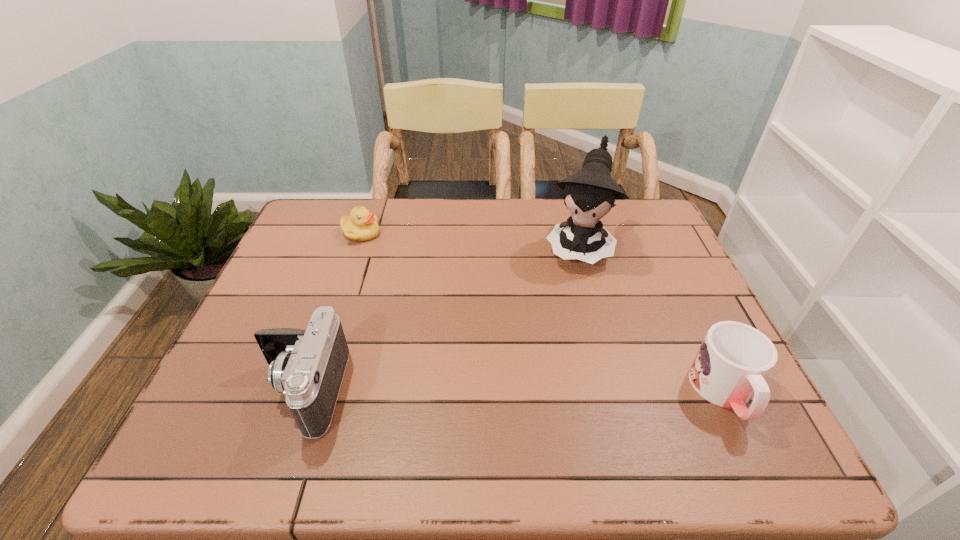
Find the location of a particular element. object at the far left corner is located at coordinates point(361,225).

This screenshot has height=540, width=960. I want to click on object that is at the near left corner, so click(307, 366).

Where is `object positioned at the near right corner`? The image size is (960, 540). object positioned at the near right corner is located at coordinates (733, 360).

Where is `vacant space at the far edge of the desktop`? vacant space at the far edge of the desktop is located at coordinates (541, 225).

You are a GUI agent. You are given a task and a screenshot of the screen. Output one action in this format:
    pyautogui.click(x=<x>, y=<y>)
    Task: Click on the vacant point at the near edge
    
    Given the screenshot: What is the action you would take?
    pyautogui.click(x=614, y=390)

Find the location of a particular element. Image resolution: width=960 pixels, height=540 pixels. vacant space at the left edge of the desktop is located at coordinates (290, 300).

Locate an element on the screen. Image resolution: width=960 pixels, height=540 pixels. vacant space at the right edge is located at coordinates (649, 316).

In the image, there is a desktop. At what (x,y) coordinates should I click in order to perform the action: click on free region at the near left corner. Please return your answer as a coordinate pair (x, y). Looking at the image, I should click on (269, 392).

At what (x,y) coordinates should I click in order to perform the action: click on blank space at the far right corner of the desktop. Please return your answer as a coordinate pair (x, y). The width and height of the screenshot is (960, 540). Looking at the image, I should click on pos(627,224).

The height and width of the screenshot is (540, 960). What are the coordinates of `empty space between the doll and the shortest object` in the screenshot? It's located at click(469, 240).